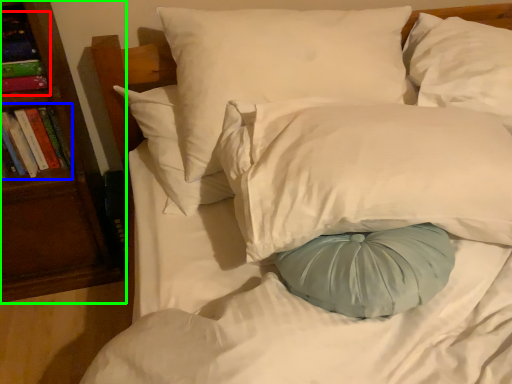
Question: Based on their relative distances, which object is farther from book (highlighted by a red box)? Choose from book (highlighted by a blue box) and bookshelf (highlighted by a green box).

Choices:
 (A) book
 (B) bookshelf

Answer: (B)